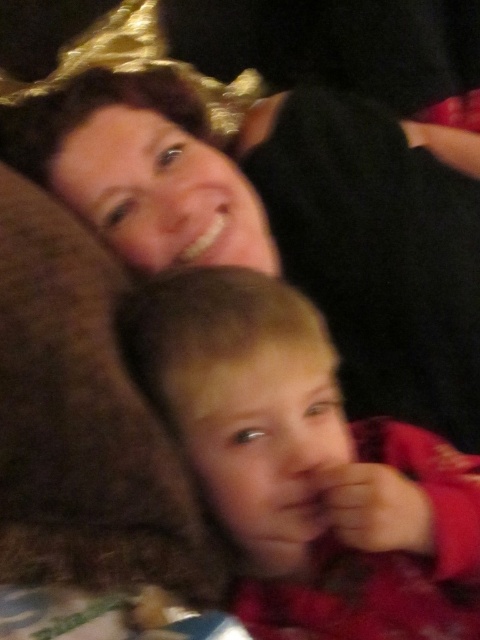
Can you confirm if matte black hair at upper center is wider than smooth red shirt at lower center?

Yes, matte black hair at upper center is wider than smooth red shirt at lower center.

Does point (344, 113) lie behind point (189, 406)?

Yes, it is behind point (189, 406).

What do you see at coordinates (286, 221) in the screenshot? I see `matte black hair at upper center` at bounding box center [286, 221].

Where is `matte black hair at upper center`? matte black hair at upper center is located at coordinates (286, 221).